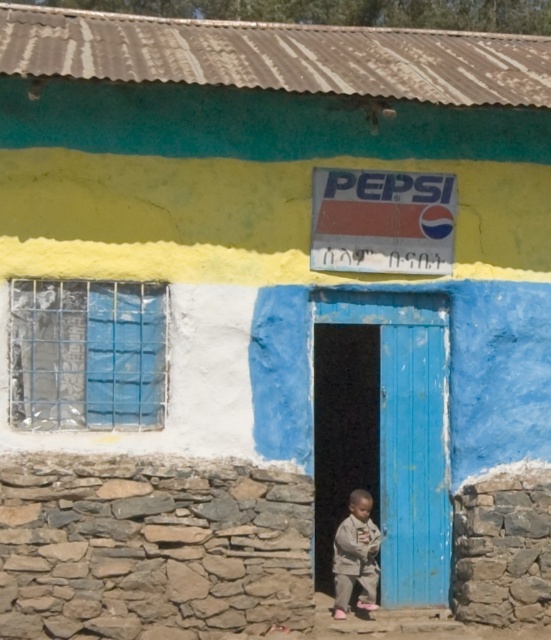
Question: Is the position of blue wooden door at center more distant than that of light brown fabric pants at lower center?

Choices:
 (A) yes
 (B) no

Answer: (A)

Question: Which of the following is the farthest from the observer?

Choices:
 (A) light brown fabric pants at lower center
 (B) blue wooden door at center

Answer: (B)

Question: In this image, where is blue wooden door at center located relative to light brown fabric pants at lower center?

Choices:
 (A) right
 (B) left

Answer: (A)

Question: Which point appears farthest from the camera in this image?

Choices:
 (A) (364, 531)
 (B) (437, 298)

Answer: (B)

Question: Which point appears closest to the camera in this image?

Choices:
 (A) (418, 604)
 (B) (364, 499)

Answer: (B)

Question: Is blue wooden door at center below light brown fabric pants at lower center?

Choices:
 (A) no
 (B) yes

Answer: (A)